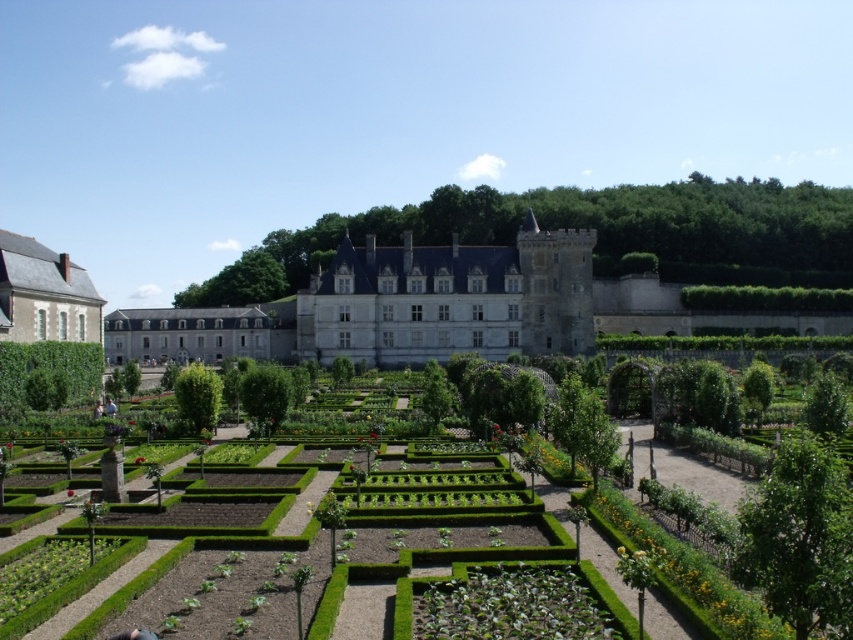
You are standing in the formal garden and want to take a photo of both point [0,280] and point [808,310]. Which point will appear larger in your camera view?

Point [0,280] will appear larger in the camera view because it is closer to the camera than point [808,310].

You are standing at the center of the garden and see a point marked at coordinates (47, 374). Which object in the garden does this point belong to?

The point at (47, 374) is on the green leafy hedge at lower left.

You are a gardener planning to plant a row of lavender between the green leafy hedge at lower left and the green leafy hedge at right. Considering their widths, which hedge requires more space between them to accommodate the lavender plants?

The green leafy hedge at right requires more space because it has a greater width than the green leafy hedge at lower left.